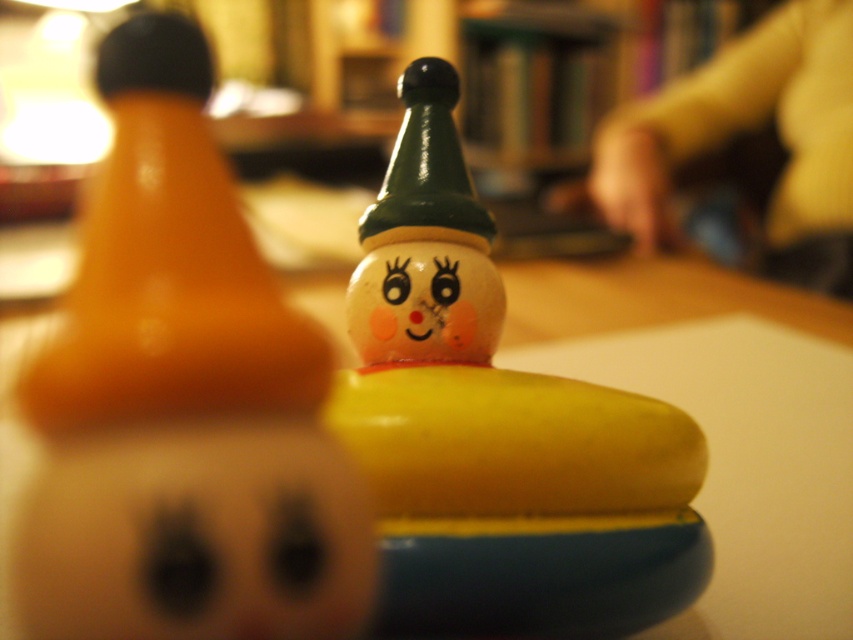
Who is more forward, (531,378) or (242,484)?

Point (242,484) is in front.

Is point (488, 392) farther from viewer compared to point (45, 556)?

Yes, it is behind point (45, 556).

What do you see at coordinates (497, 432) in the screenshot? The image size is (853, 640). I see `wooden clown at center` at bounding box center [497, 432].

The height and width of the screenshot is (640, 853). What are the coordinates of `wooden clown at center` in the screenshot? It's located at (497, 432).

Is matte orange rubber duck at left to the right of matte plastic face at center from the viewer's perspective?

Incorrect, matte orange rubber duck at left is not on the right side of matte plastic face at center.

Can you confirm if matte orange rubber duck at left is taller than matte plastic face at center?

Yes, matte orange rubber duck at left is taller than matte plastic face at center.

What do you see at coordinates (181, 401) in the screenshot? Image resolution: width=853 pixels, height=640 pixels. I see `matte orange rubber duck at left` at bounding box center [181, 401].

Identify the location of matte orange rubber duck at left. (181, 401).

Who is more distant from viewer, (132, 280) or (457, 292)?

Point (457, 292)

Which is more to the right, matte orange rubber duck at left or wooden clown at center?

wooden clown at center

Is point (210, 472) less distant than point (407, 292)?

Yes, it is.

At what (x,y) coordinates should I click in order to perform the action: click on matte orange rubber duck at left. Please return your answer as a coordinate pair (x, y). This screenshot has height=640, width=853. Looking at the image, I should click on (181, 401).